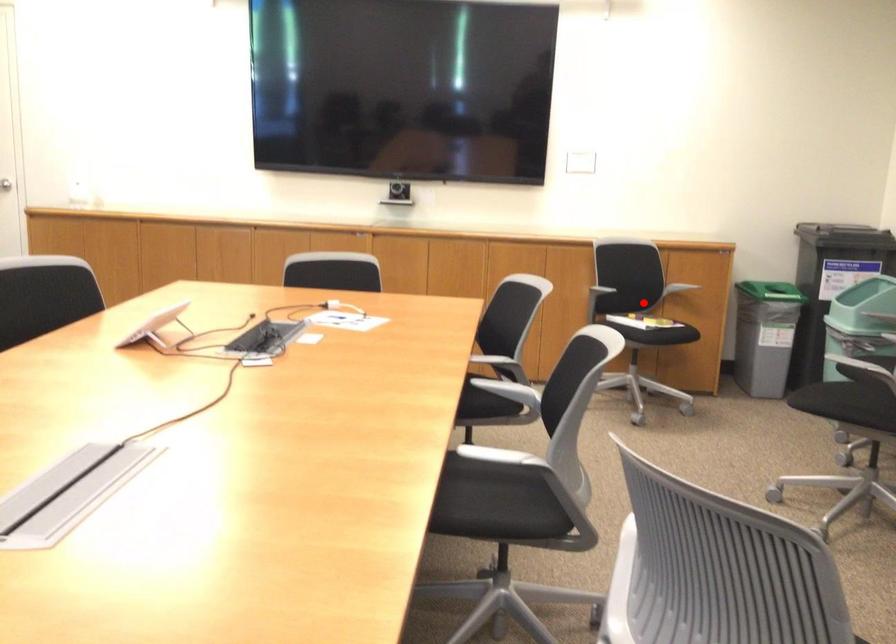
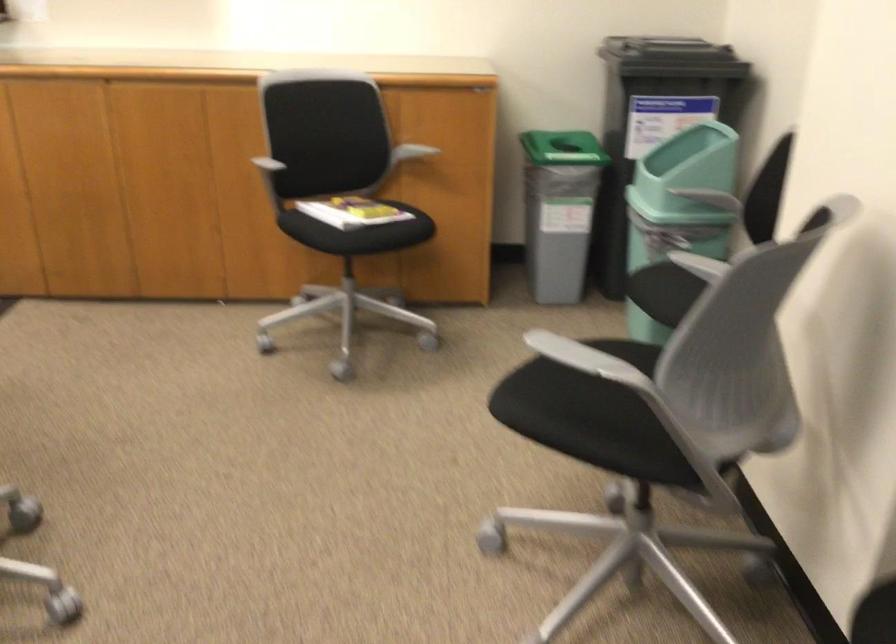
Where in the second image is the point corresponding to the highlighted location from the first image?

(351, 211)